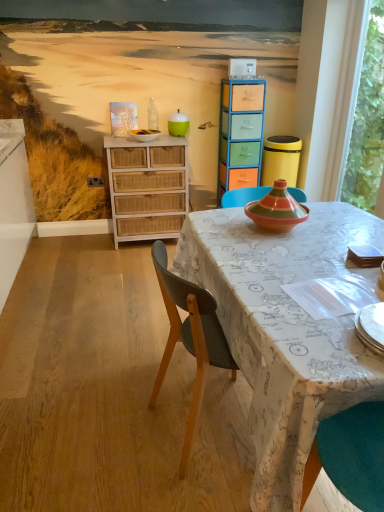
Question: Visually, is white glossy bowl at upper center positioned to the left or to the right of white wicker dresser at left?

Choices:
 (A) right
 (B) left

Answer: (A)

Question: Is white glossy bowl at upper center bigger or smaller than white wicker dresser at left?

Choices:
 (A) big
 (B) small

Answer: (B)

Question: Considering the real-world distances, which object is closest to the white glossy bowl at upper center?

Choices:
 (A) multicolored painted drawers at center
 (B) transparent glass window at right
 (C) black plastic power outlet at lower left
 (D) white plastic corded phone at upper center
 (E) translucent glass bottle at center

Answer: (E)

Question: Estimate the real-world distances between objects in this image. Which object is farther from the white plastic corded phone at upper center?

Choices:
 (A) map-patterned fabric at center
 (B) white wicker dresser at left
 (C) multicolored painted drawers at center
 (D) transparent glass window at right
 (E) white glossy bowl at upper center

Answer: (A)